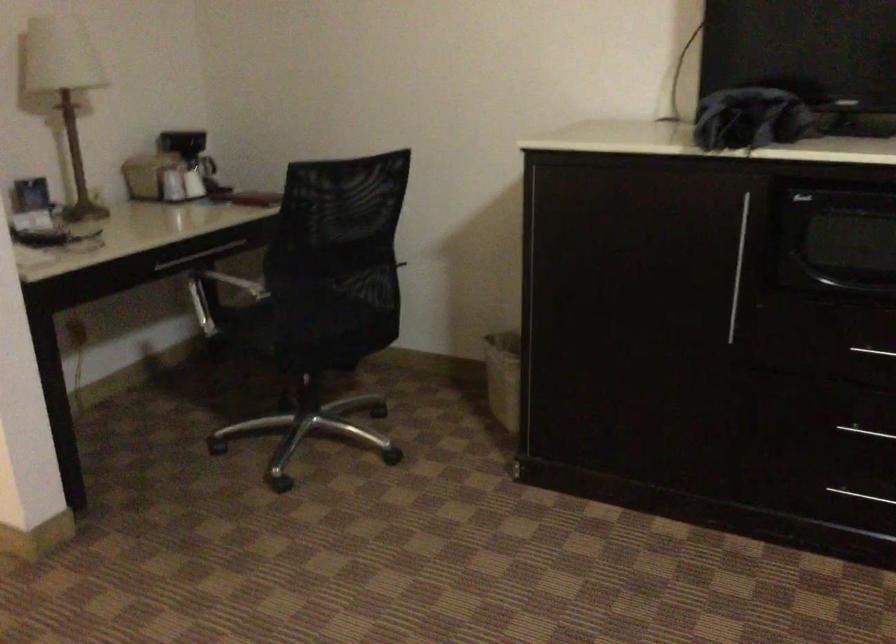
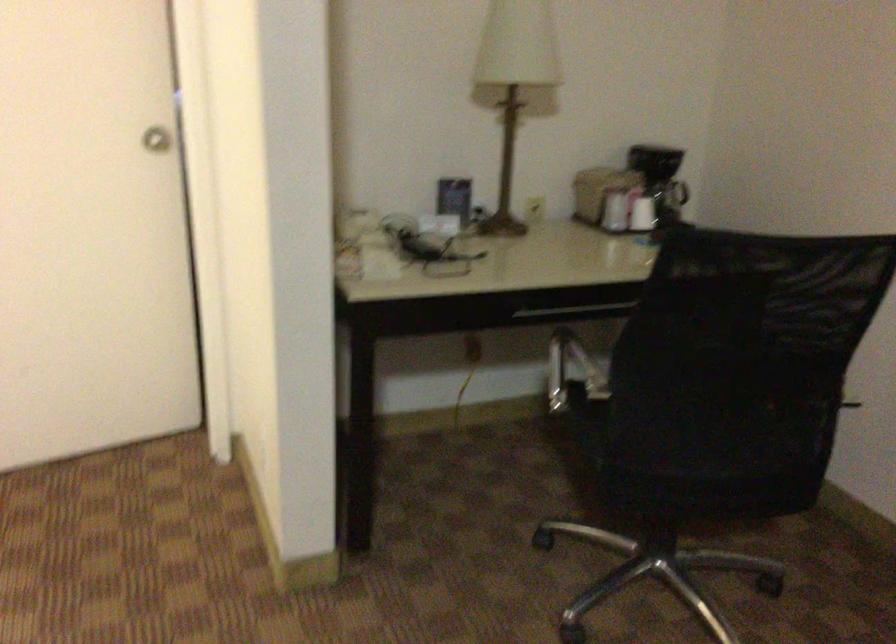
In the second image, find the point that corresponds to (x=200, y=172) in the first image.

(677, 202)